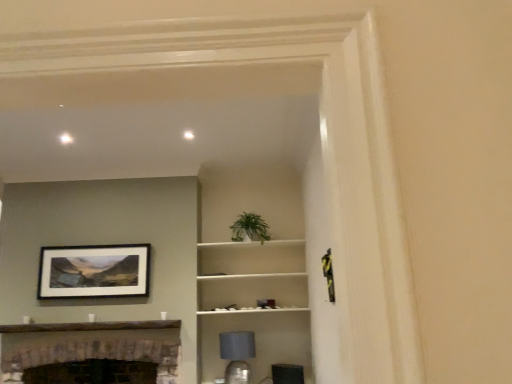
Question: Should I look upward or downward to see brick fireplace at lower left?

Choices:
 (A) up
 (B) down

Answer: (B)

Question: Should I look upward or downward to see matte gray lampshade at lower center?

Choices:
 (A) up
 (B) down

Answer: (B)

Question: Is matte gray lampshade at lower center bigger than matte black picture frame at upper left?

Choices:
 (A) no
 (B) yes

Answer: (B)

Question: From the image's perspective, would you say matte gray lampshade at lower center is positioned over matte black picture frame at upper left?

Choices:
 (A) no
 (B) yes

Answer: (A)

Question: Is matte gray lampshade at lower center facing towards matte black picture frame at upper left?

Choices:
 (A) yes
 (B) no

Answer: (B)

Question: Does matte gray lampshade at lower center appear on the right side of matte black picture frame at upper left?

Choices:
 (A) no
 (B) yes

Answer: (B)

Question: Can you confirm if matte gray lampshade at lower center is smaller than matte black picture frame at upper left?

Choices:
 (A) yes
 (B) no

Answer: (B)

Question: Does matte gray lampshade at lower center have a lesser width compared to matte black picture frame at upper left?

Choices:
 (A) no
 (B) yes

Answer: (A)

Question: Considering the relative sizes of white matte shelf at center and matte gray lampshade at lower center in the image provided, is white matte shelf at center bigger than matte gray lampshade at lower center?

Choices:
 (A) no
 (B) yes

Answer: (B)

Question: From the image's perspective, does white matte shelf at center appear higher than matte gray lampshade at lower center?

Choices:
 (A) yes
 (B) no

Answer: (A)

Question: Does white matte shelf at center contain matte gray lampshade at lower center?

Choices:
 (A) no
 (B) yes

Answer: (A)

Question: Can you confirm if white matte shelf at center is positioned to the left of matte gray lampshade at lower center?

Choices:
 (A) yes
 (B) no

Answer: (B)

Question: From a real-world perspective, is white matte shelf at center positioned over matte gray lampshade at lower center based on gravity?

Choices:
 (A) yes
 (B) no

Answer: (A)

Question: Can you confirm if white matte shelf at center is thinner than matte gray lampshade at lower center?

Choices:
 (A) no
 (B) yes

Answer: (A)

Question: Considering the relative sizes of matte gray lampshade at lower center and brick fireplace at lower left in the image provided, is matte gray lampshade at lower center bigger than brick fireplace at lower left?

Choices:
 (A) yes
 (B) no

Answer: (B)